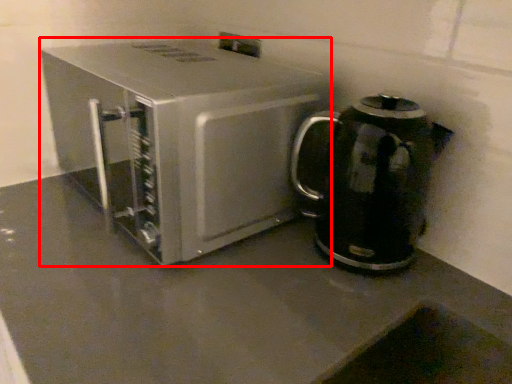
Question: From the image's perspective, what is the correct spatial positioning of kitchen appliance (annotated by the red box) in reference to kitchen appliance?

Choices:
 (A) below
 (B) above

Answer: (B)